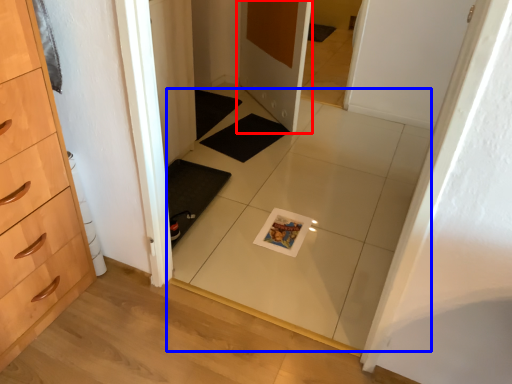
Question: Which of the following is the closest to the observer, door (highlighted by a red box) or tile (highlighted by a blue box)?

Choices:
 (A) door
 (B) tile

Answer: (B)